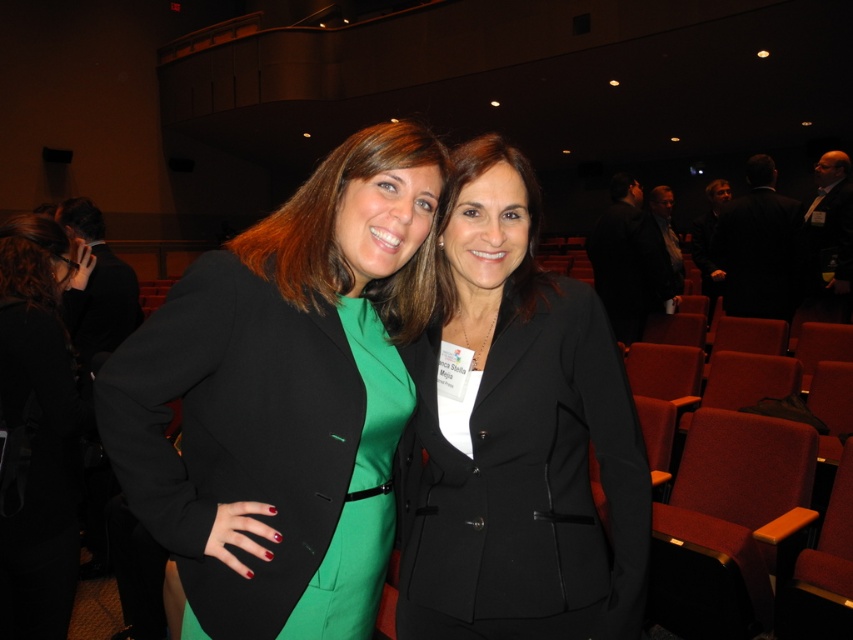
Does matte black blazer at center appear on the left side of black matte blazer at left?

Incorrect, matte black blazer at center is not on the left side of black matte blazer at left.

Does matte black blazer at center have a greater height compared to black matte blazer at left?

Yes, matte black blazer at center is taller than black matte blazer at left.

Where is `matte black blazer at center`? This screenshot has height=640, width=853. matte black blazer at center is located at coordinates pyautogui.click(x=285, y=396).

The image size is (853, 640). Identify the location of matte black blazer at center. (285, 396).

Which is above, black matte blazer at center or green satin dress at center?

black matte blazer at center is higher up.

Which of these two, black matte blazer at center or green satin dress at center, stands taller?

black matte blazer at center

Where is `black matte blazer at center`? black matte blazer at center is located at coordinates (518, 435).

Between black matte blazer at center and black matte suit at center, which one appears on the left side from the viewer's perspective?

Positioned to the left is black matte blazer at center.

Is black matte blazer at center behind black matte suit at center?

No.

Is point (457, 275) in front of point (672, 291)?

Yes.

The width and height of the screenshot is (853, 640). I want to click on black matte blazer at center, so click(518, 435).